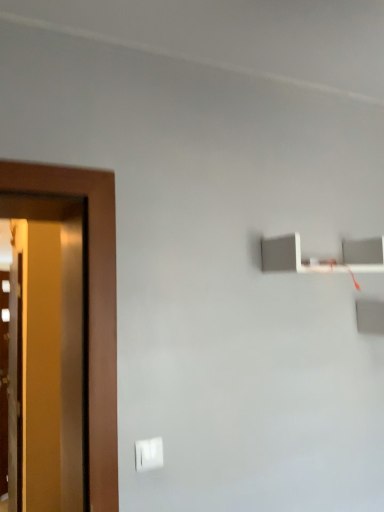
What do you see at coordinates (149, 454) in the screenshot? I see `white plastic light switch at lower center` at bounding box center [149, 454].

Where is `white plastic light switch at lower center`? This screenshot has height=512, width=384. white plastic light switch at lower center is located at coordinates (149, 454).

In order to face white plastic light switch at lower center, should I rotate leftwards or rightwards?

To face it directly, rotate left by 5.615 degrees.

Identify the location of white matte shelf at upper right. (321, 260).

Describe the element at coordinates (321, 260) in the screenshot. The image size is (384, 512). I see `white matte shelf at upper right` at that location.

At what (x,y) coordinates should I click in order to perform the action: click on white plastic light switch at lower center. Please return your answer as a coordinate pair (x, y). Looking at the image, I should click on (149, 454).

Considering the relative positions of white matte shelf at upper right and white plastic light switch at lower center in the image provided, is white matte shelf at upper right to the left or to the right of white plastic light switch at lower center?

Based on their positions, white matte shelf at upper right is located to the right of white plastic light switch at lower center.

Which object is closer to the camera taking this photo, white matte shelf at upper right or white plastic light switch at lower center?

white plastic light switch at lower center is closer to the camera.

Which is nearer, (278,263) or (159,452)?

Point (278,263) is positioned farther from the camera compared to point (159,452).

From the image's perspective, is white matte shelf at upper right on top of white plastic light switch at lower center?

Indeed, from the image's perspective, white matte shelf at upper right is shown above white plastic light switch at lower center.

Based on the photo, from a real-world perspective, who is located higher, white matte shelf at upper right or white plastic light switch at lower center?

white matte shelf at upper right.

Between white matte shelf at upper right and white plastic light switch at lower center, which one has smaller width?

Thinner between the two is white plastic light switch at lower center.

Between white matte shelf at upper right and white plastic light switch at lower center, which one has more height?

With more height is white matte shelf at upper right.

Considering the relative sizes of white matte shelf at upper right and white plastic light switch at lower center in the image provided, is white matte shelf at upper right bigger than white plastic light switch at lower center?

Yes, white matte shelf at upper right is bigger than white plastic light switch at lower center.

Is white matte shelf at upper right surrounding white plastic light switch at lower center?

That's incorrect, white plastic light switch at lower center is not inside white matte shelf at upper right.

Are white matte shelf at upper right and white plastic light switch at lower center located far from each other?

Actually, white matte shelf at upper right and white plastic light switch at lower center are a little close together.

Is white matte shelf at upper right facing away from white plastic light switch at lower center?

white matte shelf at upper right does not have its back to white plastic light switch at lower center.

Can you tell me how much white matte shelf at upper right and white plastic light switch at lower center differ in facing direction?

The angular difference between white matte shelf at upper right and white plastic light switch at lower center is 1.58 degrees.

The image size is (384, 512). What are the coordinates of `light switch below the white matte shelf at upper right (from a real-world perspective)` in the screenshot? It's located at (149, 454).

From the picture: Is white plastic light switch at lower center to the left or to the right of white matte shelf at upper right in the image?

white plastic light switch at lower center is to the left of white matte shelf at upper right.

Between white plastic light switch at lower center and white matte shelf at upper right, which one is positioned behind?

Positioned behind is white matte shelf at upper right.

Is point (147, 460) closer or farther from the camera than point (378, 250)?

Point (147, 460) is closer to the camera than point (378, 250).

From the image's perspective, which is above, white plastic light switch at lower center or white matte shelf at upper right?

white matte shelf at upper right.

From a real-world perspective, is white plastic light switch at lower center above or below white matte shelf at upper right?

Clearly, from a real-world perspective, white plastic light switch at lower center is below white matte shelf at upper right.

Which object is wider, white plastic light switch at lower center or white matte shelf at upper right?

white matte shelf at upper right.

Considering the relative sizes of white plastic light switch at lower center and white matte shelf at upper right in the image provided, is white plastic light switch at lower center shorter than white matte shelf at upper right?

Yes.

Which of these two, white plastic light switch at lower center or white matte shelf at upper right, is smaller?

With smaller size is white plastic light switch at lower center.

Is white plastic light switch at lower center situated inside white matte shelf at upper right or outside?

The correct answer is: outside.

Is white plastic light switch at lower center not close to white matte shelf at upper right?

No.

Is white plastic light switch at lower center oriented towards white matte shelf at upper right?

No, white plastic light switch at lower center is not aimed at white matte shelf at upper right.

Based on the photo, can you tell me how much white plastic light switch at lower center and white matte shelf at upper right differ in facing direction?

1.58 degrees separate the facing orientations of white plastic light switch at lower center and white matte shelf at upper right.

How distant is white plastic light switch at lower center from white matte shelf at upper right?

white plastic light switch at lower center is 32.10 inches from white matte shelf at upper right.

Where is `light switch that is on the left side of white matte shelf at upper right`? This screenshot has width=384, height=512. light switch that is on the left side of white matte shelf at upper right is located at coordinates (149, 454).

The height and width of the screenshot is (512, 384). I want to click on shelf on the right of white plastic light switch at lower center, so click(321, 260).

Locate an element on the screen. shelf lying above the white plastic light switch at lower center (from the image's perspective) is located at coordinates (321, 260).